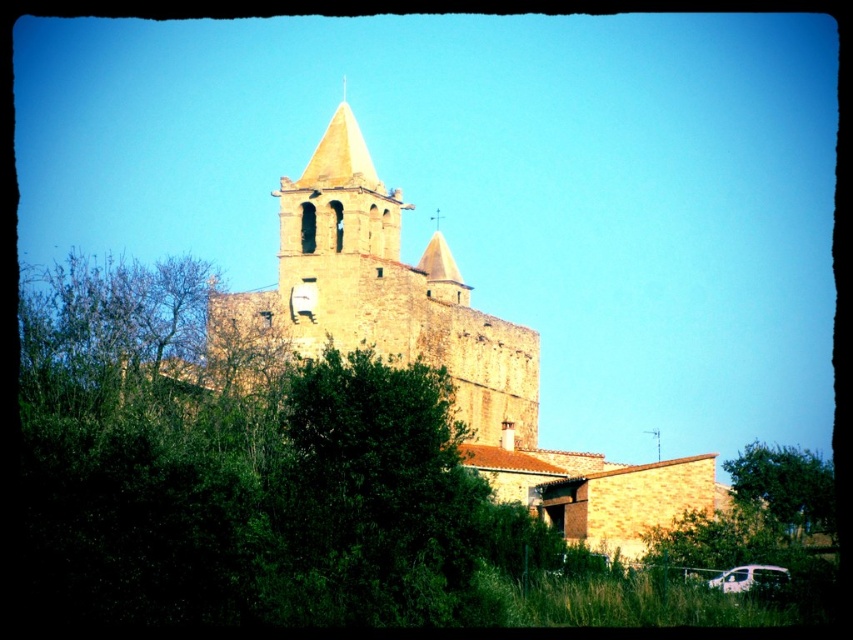
Consider the image. Can you confirm if stone church at center is positioned to the right of white matte van at lower right?

Incorrect, stone church at center is not on the right side of white matte van at lower right.

Between point (372, 298) and point (735, 588), which one is positioned in front?

Point (735, 588) is in front.

The image size is (853, 640). What do you see at coordinates (380, 291) in the screenshot?
I see `stone church at center` at bounding box center [380, 291].

Find the location of a particular element. Image resolution: width=853 pixels, height=640 pixels. stone church at center is located at coordinates (380, 291).

Which is below, brown stone church at center or green leafy tree at lower right?

green leafy tree at lower right is below.

Is brown stone church at center below green leafy tree at lower right?

Incorrect, brown stone church at center is not positioned below green leafy tree at lower right.

What are the coordinates of `brown stone church at center` in the screenshot? It's located at (442, 349).

Describe the element at coordinates (442, 349) in the screenshot. The width and height of the screenshot is (853, 640). I see `brown stone church at center` at that location.

Does point (218, 348) come in front of point (271, 332)?

No, (218, 348) is behind (271, 332).

This screenshot has height=640, width=853. What are the coordinates of `brown stone church at center` in the screenshot? It's located at (442, 349).